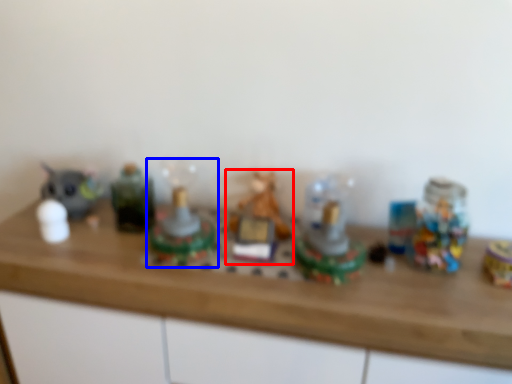
Question: Which point is further to the camera, toy (highlighted by a red box) or toy (highlighted by a blue box)?

Choices:
 (A) toy
 (B) toy

Answer: (A)